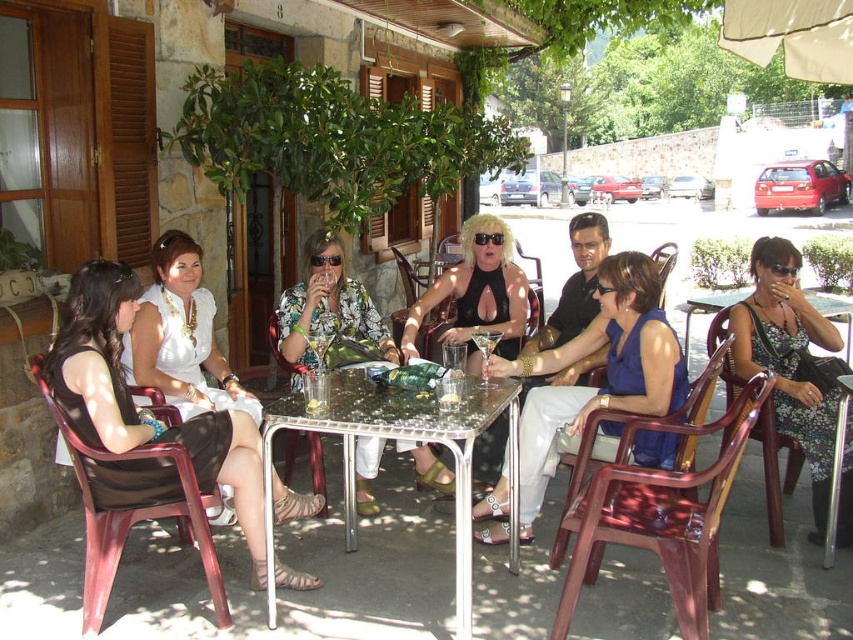
Question: Which point is closer to the camera?

Choices:
 (A) (537, 387)
 (B) (53, 406)

Answer: (B)

Question: Does translucent plastic chair at center appear over metallic glass table at center?

Choices:
 (A) yes
 (B) no

Answer: (B)

Question: Does black leather dress at center lie in front of transparent plastic chair at lower left?

Choices:
 (A) yes
 (B) no

Answer: (B)

Question: Which object appears closest to the camera in this image?

Choices:
 (A) translucent plastic chair at center
 (B) plastic chair at center
 (C) matte black dress at left

Answer: (A)

Question: Which point is farther from the camera taking this photo?

Choices:
 (A) (334, 289)
 (B) (308, 573)

Answer: (A)

Question: Is matte black dress at left behind black leather dress at center?

Choices:
 (A) yes
 (B) no

Answer: (B)